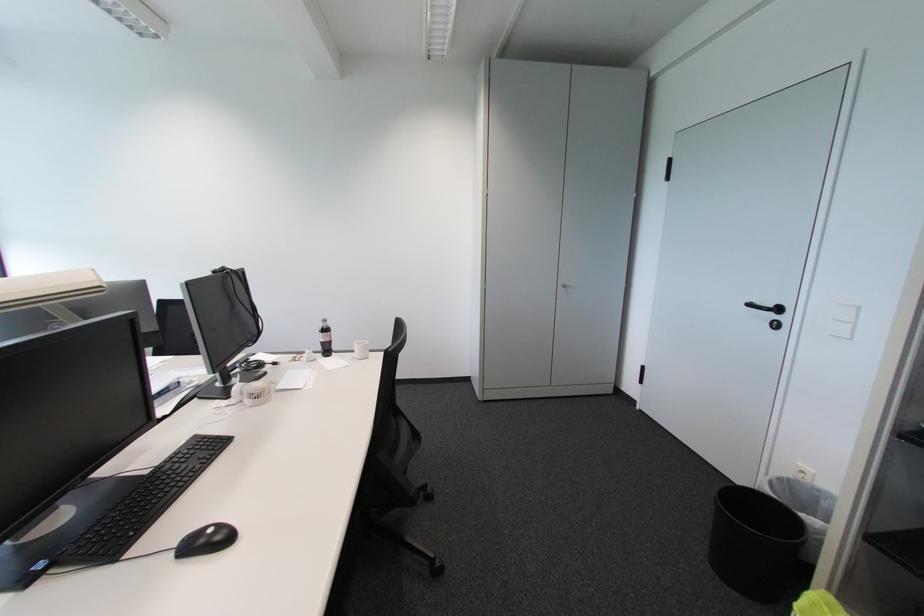
At what (x,y) coordinates should I click in order to perform the action: click on gray trash can. Please return your answer as a coordinate pair (x, y). Looking at the image, I should click on (755, 543).